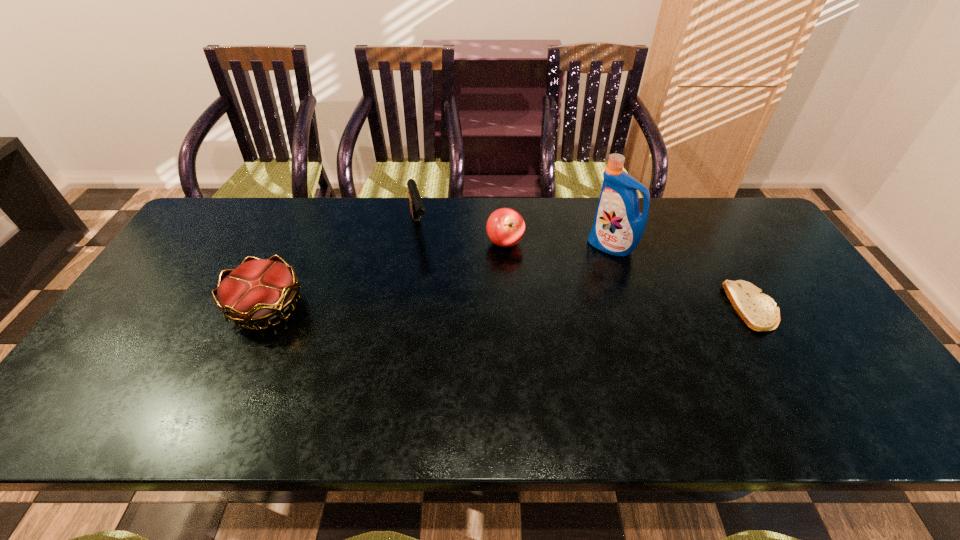
You are a GUI agent. You are given a task and a screenshot of the screen. Output one action in this format:
    pyautogui.click(x=<x>, y=<y>)
    Task: Click on the crown
    
    Given the screenshot: What is the action you would take?
    pyautogui.click(x=258, y=290)

The height and width of the screenshot is (540, 960). I want to click on the rightmost object, so click(x=759, y=311).

Where is `pita bread`? pita bread is located at coordinates (759, 311).

At what (x,y) coordinates should I click in order to perform the action: click on the fourth object from left to right. Please return your answer as a coordinate pair (x, y). The width and height of the screenshot is (960, 540). Looking at the image, I should click on (618, 227).

Identify the location of the tallest object. Image resolution: width=960 pixels, height=540 pixels. (618, 227).

This screenshot has width=960, height=540. Identify the location of the third object from right to left. (505, 227).

Locate an element on the screen. This screenshot has height=540, width=960. pistol is located at coordinates (417, 208).

In order to click on the fourth shortest object in this screenshot , I will do `click(417, 208)`.

Where is `free space located on the left of the leftmost object`? Image resolution: width=960 pixels, height=540 pixels. free space located on the left of the leftmost object is located at coordinates (155, 307).

You are a GUI agent. You are given a task and a screenshot of the screen. Output one action in this format:
    pyautogui.click(x=<x>, y=<y>)
    Task: Click on the vacant space situated 0.360m on the left of the rightmost object
    
    Given the screenshot: What is the action you would take?
    pyautogui.click(x=597, y=308)